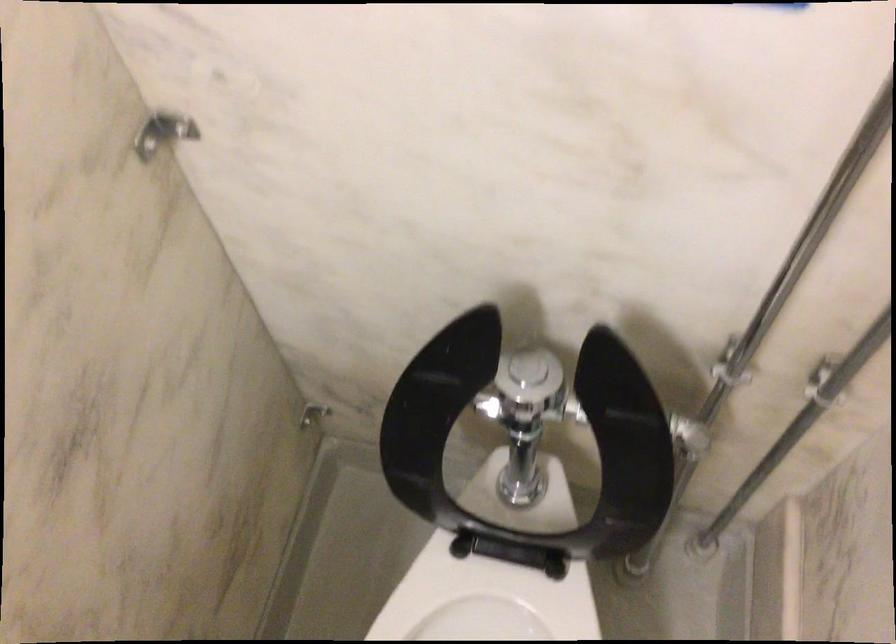
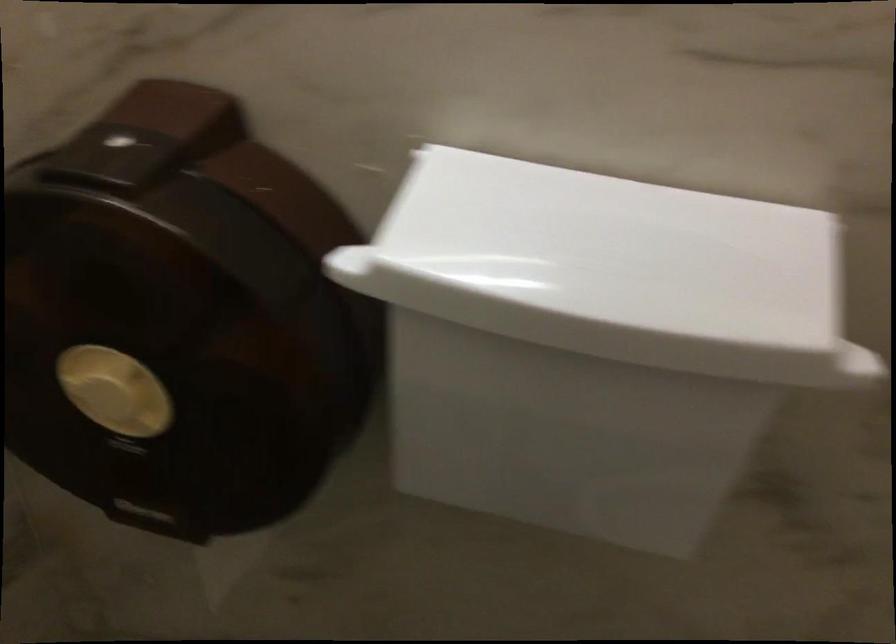
The images are taken continuously from a first-person perspective. In which direction is your viewpoint rotating?

The camera rotated toward left-down.